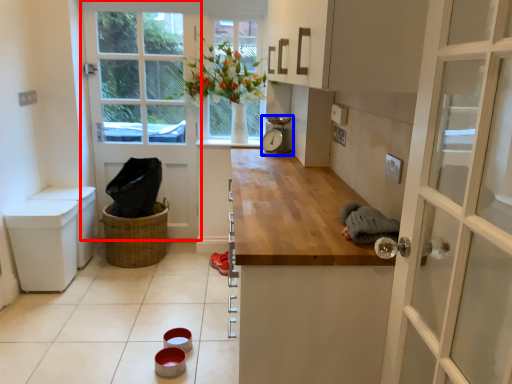
Question: Among these objects, which one is nearest to the camera, door (highlighted by a red box) or appliance (highlighted by a blue box)?

Choices:
 (A) door
 (B) appliance

Answer: (B)